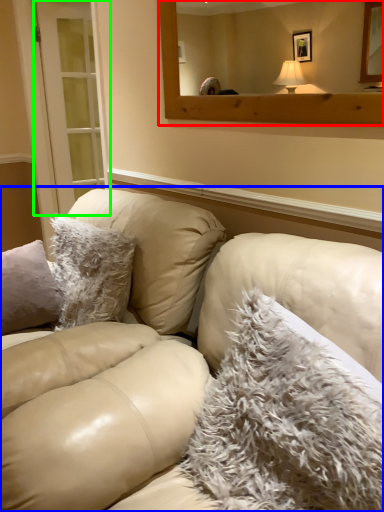
Question: Considering the real-world distances, which object is farthest from mirror (highlighted by a red box)? studio couch (highlighted by a blue box) or glass door (highlighted by a green box)?

Choices:
 (A) studio couch
 (B) glass door

Answer: (B)